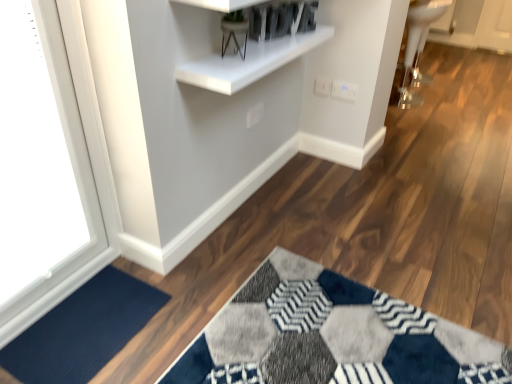
Image resolution: width=512 pixels, height=384 pixels. What are the coordinates of `white glossy window at upper left` in the screenshot? It's located at [x=49, y=163].

The image size is (512, 384). What do you see at coordinates (323, 86) in the screenshot?
I see `white plastic electric outlet at upper right, the second electric outlet in the right-to-left sequence` at bounding box center [323, 86].

Locate an element on the screen. The height and width of the screenshot is (384, 512). white glossy sink at upper right is located at coordinates (417, 48).

Image resolution: width=512 pixels, height=384 pixels. Find the location of `white plastic electric outlet at upper center, the first electric outlet from the right`. white plastic electric outlet at upper center, the first electric outlet from the right is located at coordinates coord(344,90).

Locate an element on the screen. Image resolution: width=512 pixels, height=384 pixels. white glossy window at upper left is located at coordinates (49, 163).

In the image, there is a white glossy window at upper left. Where is `shelf above it (from the image's perspective)`? This screenshot has height=384, width=512. shelf above it (from the image's perspective) is located at coordinates (250, 61).

What's the angular difference between white glossy window at upper left and white glossy shelf at upper center's facing directions?

The angle between the facing direction of white glossy window at upper left and the facing direction of white glossy shelf at upper center is 1.19 degrees.

From a real-world perspective, is white glossy window at upper left located higher than white glossy shelf at upper center?

No.

Is white glossy window at upper left positioned with its back to white glossy shelf at upper center?

No, white glossy window at upper left is not facing the opposite direction of white glossy shelf at upper center.

Is point (2, 271) more distant than point (341, 95)?

No, (2, 271) is in front of (341, 95).

This screenshot has height=384, width=512. What are the coordinates of `window in front of the white plastic electric outlet at upper center, the first electric outlet from the right` in the screenshot? It's located at (49, 163).

Is there a large distance between white glossy window at upper left and white plastic electric outlet at upper center, the 2th electric outlet when ordered from left to right?

white glossy window at upper left is far away from white plastic electric outlet at upper center, the 2th electric outlet when ordered from left to right.

Based on the photo, from the image's perspective, which one is positioned lower, white glossy window at upper left or white plastic electric outlet at upper center, the first electric outlet from the right?

white glossy window at upper left, from the image's perspective.

Looking at this image, is navy blue carpet at lower left taller or shorter than white glossy sink at upper right?

Clearly, navy blue carpet at lower left is shorter compared to white glossy sink at upper right.

Do you think navy blue carpet at lower left is within white glossy sink at upper right, or outside of it?

navy blue carpet at lower left is not enclosed by white glossy sink at upper right.

How distant is navy blue carpet at lower left from white glossy sink at upper right?

They are 2.28 meters apart.

Is navy blue carpet at lower left in contact with white glossy sink at upper right?

No, navy blue carpet at lower left is not with white glossy sink at upper right.

Which of these two, navy blue carpet at lower left or white glossy window at upper left, is thinner?

With smaller width is white glossy window at upper left.

Is navy blue carpet at lower left looking in the opposite direction of white glossy window at upper left?

navy blue carpet at lower left is not turned away from white glossy window at upper left.

Consider the image. Can you see navy blue carpet at lower left touching white glossy window at upper left?

There is a gap between navy blue carpet at lower left and white glossy window at upper left.

From the image's perspective, which one is positioned higher, navy blue carpet at lower left or white glossy window at upper left?

white glossy window at upper left is shown above in the image.

From the image's perspective, is white glossy sink at upper right above navy blue carpet at lower left?

Yes.

Is white glossy sink at upper right taller than navy blue carpet at lower left?

Yes.

Is white glossy sink at upper right inside or outside of navy blue carpet at lower left?

white glossy sink at upper right is outside navy blue carpet at lower left.

Does white glossy shelf at upper center have a lesser height compared to white plastic electric outlet at upper center, the 2th electric outlet when ordered from left to right?

Yes, white glossy shelf at upper center is shorter than white plastic electric outlet at upper center, the 2th electric outlet when ordered from left to right.

Would you say white glossy shelf at upper center is a long distance from white plastic electric outlet at upper center, the first electric outlet from the right?

No, white glossy shelf at upper center is not far away from white plastic electric outlet at upper center, the first electric outlet from the right.

From the image's perspective, which object appears higher, white glossy shelf at upper center or white plastic electric outlet at upper center, the first electric outlet from the right?

white glossy shelf at upper center.

The height and width of the screenshot is (384, 512). There is a white plastic electric outlet at upper center, the first electric outlet from the right. Find the location of `shelf above it (from a real-world perspective)`. shelf above it (from a real-world perspective) is located at coordinates (250, 61).

Which is behind, white plastic electric outlet at upper center, the 2th electric outlet when ordered from left to right, or white glossy window at upper left?

white plastic electric outlet at upper center, the 2th electric outlet when ordered from left to right, is more distant.

Does point (337, 89) lie behind point (62, 170)?

Yes, it is behind point (62, 170).

Does white plastic electric outlet at upper center, the 2th electric outlet when ordered from left to right, have a greater height compared to white glossy window at upper left?

No.

The image size is (512, 384). I want to click on window located in front of the white plastic electric outlet at upper center, the first electric outlet from the right, so 49,163.

Where is `shelf on the right of white glossy window at upper left`? shelf on the right of white glossy window at upper left is located at coordinates [250, 61].

At what (x,y) coordinates should I click in order to perform the action: click on window that is above the white plastic electric outlet at upper center, the 2th electric outlet when ordered from left to right (from a real-world perspective). Please return your answer as a coordinate pair (x, y). Looking at the image, I should click on (49, 163).

Based on their spatial positions, is white glossy shelf at upper center or white glossy window at upper left further from white glossy sink at upper right?

white glossy window at upper left is further to white glossy sink at upper right.

When comparing their distances from white glossy window at upper left, does white plastic electric outlet at upper center, the 2th electric outlet when ordered from left to right, or navy blue carpet at lower left seem further?

Among the two, white plastic electric outlet at upper center, the 2th electric outlet when ordered from left to right, is located further to white glossy window at upper left.

In the scene shown: Which object lies nearer to the anchor point white plastic electric outlet at upper right, which is the 1th electric outlet in left-to-right order, navy blue carpet at lower left or white plastic electric outlet at upper center, the 2th electric outlet when ordered from left to right?

Based on the image, white plastic electric outlet at upper center, the 2th electric outlet when ordered from left to right, appears to be nearer to white plastic electric outlet at upper right, which is the 1th electric outlet in left-to-right order.

When comparing their distances from white glossy window at upper left, does white glossy shelf at upper center or white glossy sink at upper right seem closer?

Based on the image, white glossy shelf at upper center appears to be nearer to white glossy window at upper left.

Which object lies nearer to the anchor point navy blue carpet at lower left, white glossy window at upper left or white plastic electric outlet at upper center, the first electric outlet from the right?

The object closer to navy blue carpet at lower left is white glossy window at upper left.

Considering their positions, is white plastic electric outlet at upper center, the first electric outlet from the right, positioned closer to white glossy window at upper left than white glossy sink at upper right?

white plastic electric outlet at upper center, the first electric outlet from the right, is closer to white glossy window at upper left.

Based on their spatial positions, is navy blue carpet at lower left or white plastic electric outlet at upper center, the first electric outlet from the right, closer to white glossy window at upper left?

Based on the image, navy blue carpet at lower left appears to be nearer to white glossy window at upper left.

When comparing their distances from white glossy sink at upper right, does white plastic electric outlet at upper right, which is the 1th electric outlet in left-to-right order, or navy blue carpet at lower left seem closer?

white plastic electric outlet at upper right, which is the 1th electric outlet in left-to-right order.

I want to click on shelf located between navy blue carpet at lower left and white glossy sink at upper right in the left-right direction, so click(250, 61).

The width and height of the screenshot is (512, 384). I want to click on doormat between white glossy window at upper left and white plastic electric outlet at upper right, the second electric outlet in the right-to-left sequence, from front to back, so click(83, 330).

Locate an element on the screen. This screenshot has width=512, height=384. shelf between white glossy window at upper left and white plastic electric outlet at upper right, which is the 1th electric outlet in left-to-right order, along the z-axis is located at coordinates (250, 61).

Locate an element on the screen. electric outlet between white plastic electric outlet at upper right, the second electric outlet in the right-to-left sequence, and white glossy sink at upper right, in the horizontal direction is located at coordinates (344, 90).